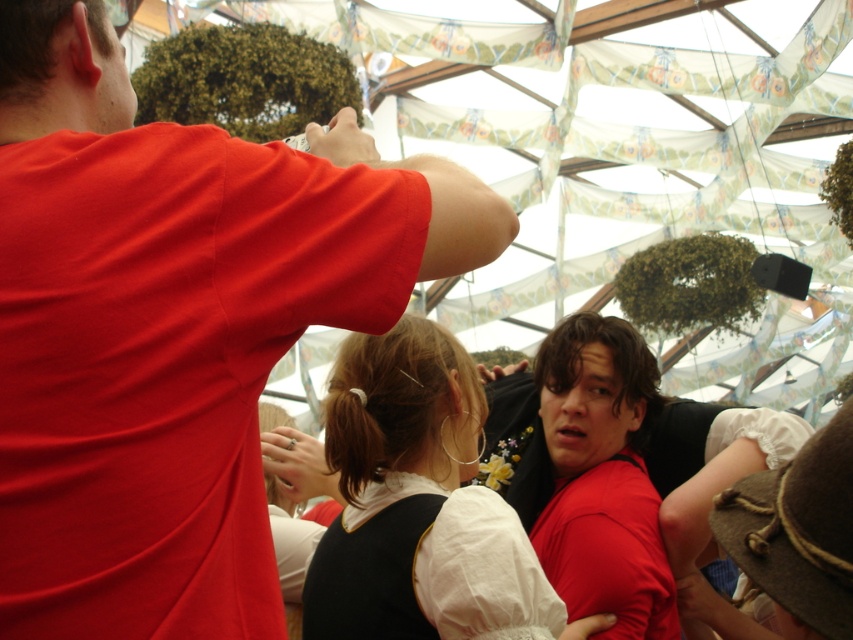
Which is in front, point (57, 616) or point (648, 540)?

Point (57, 616) is in front.

Between matte red shirt at upper left and matte white blouse at center, which one is positioned lower?

matte white blouse at center is below.

Image resolution: width=853 pixels, height=640 pixels. Describe the element at coordinates (172, 326) in the screenshot. I see `matte red shirt at upper left` at that location.

This screenshot has width=853, height=640. In order to click on matte red shirt at upper left in this screenshot , I will do `click(172, 326)`.

Does matte black dress at center have a lesser width compared to matte white blouse at center?

No, matte black dress at center is not thinner than matte white blouse at center.

How far apart are matte black dress at center and matte white blouse at center?

They are 7.67 meters apart.

Who is more forward, (366, 552) or (601, 499)?

Point (366, 552) is more forward.

You are a GUI agent. You are given a task and a screenshot of the screen. Output one action in this format:
    pyautogui.click(x=<x>, y=<y>)
    Task: Click on the matte black dress at center
    The image size is (853, 640).
    Given the screenshot: What is the action you would take?
    pyautogui.click(x=416, y=502)

Can you confirm if matte red shirt at center is smaller than matte white blouse at center?

No.

Where is `matte red shirt at center`? matte red shirt at center is located at coordinates (628, 428).